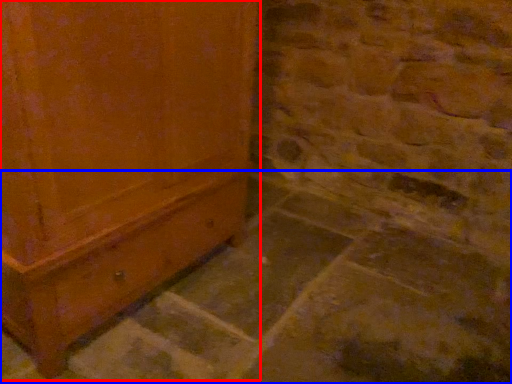
Question: Which of the following is the farthest to the observer, furniture (highlighted by a red box) or concrete (highlighted by a blue box)?

Choices:
 (A) furniture
 (B) concrete

Answer: (A)